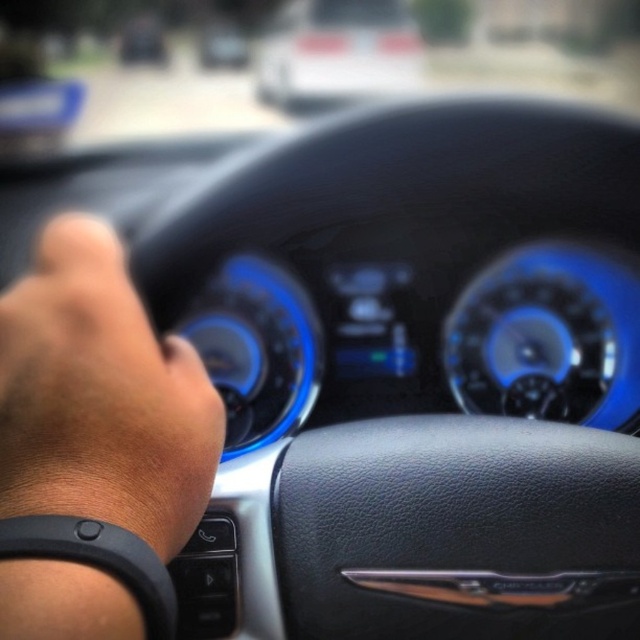
Question: Does white glossy car at upper center appear over matte black steering wheel at center?

Choices:
 (A) yes
 (B) no

Answer: (B)

Question: Which point is closer to the camera?

Choices:
 (A) dark skin wristband at lower left
 (B) matte black steering wheel at center

Answer: (A)

Question: Is dark skin wristband at lower left below matte black steering wheel at center?

Choices:
 (A) no
 (B) yes

Answer: (B)

Question: Which object is positioned farthest from the white glossy car at upper center?

Choices:
 (A) matte black steering wheel at center
 (B) dark skin wristband at lower left

Answer: (B)

Question: Which object is positioned closest to the white glossy car at upper center?

Choices:
 (A) matte black steering wheel at center
 (B) dark skin wristband at lower left

Answer: (A)

Question: Does white glossy car at upper center lie behind matte black steering wheel at center?

Choices:
 (A) no
 (B) yes

Answer: (A)